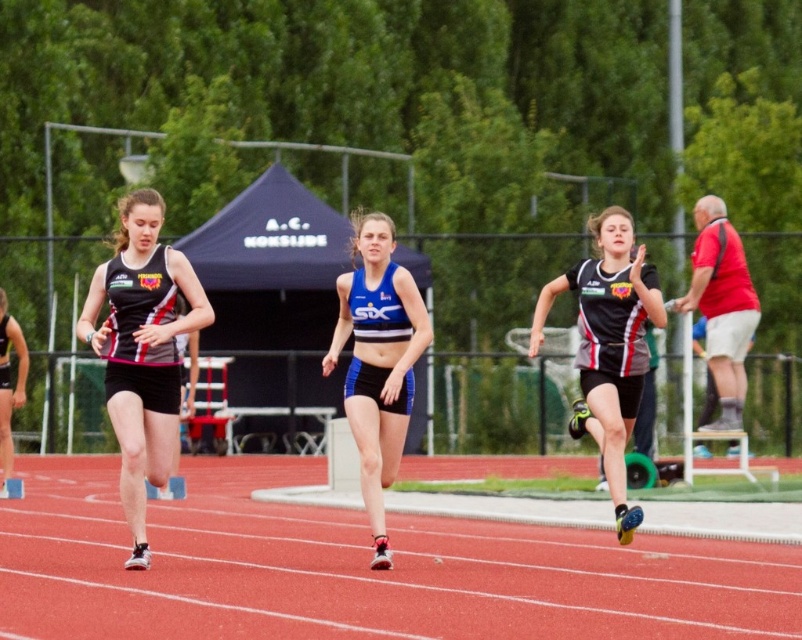
Question: Which of the following is the farthest from the observer?

Choices:
 (A) black matte running uniform at left
 (B) black matte running suit at center

Answer: (B)

Question: Is red rubber track at center closer to the viewer compared to blue matte shorts at center?

Choices:
 (A) no
 (B) yes

Answer: (B)

Question: Is red rubber track at center smaller than black matte running suit at center?

Choices:
 (A) no
 (B) yes

Answer: (A)

Question: Can you confirm if black matte running suit at center is positioned to the right of red cotton shirt at right?

Choices:
 (A) no
 (B) yes

Answer: (A)

Question: Which of the following is the farthest from the observer?

Choices:
 (A) (358, 412)
 (B) (626, 241)
 (C) (424, 621)
 (D) (695, 252)

Answer: (D)

Question: Which object appears farthest from the camera in this image?

Choices:
 (A) black matte running uniform at left
 (B) red rubber track at center

Answer: (A)